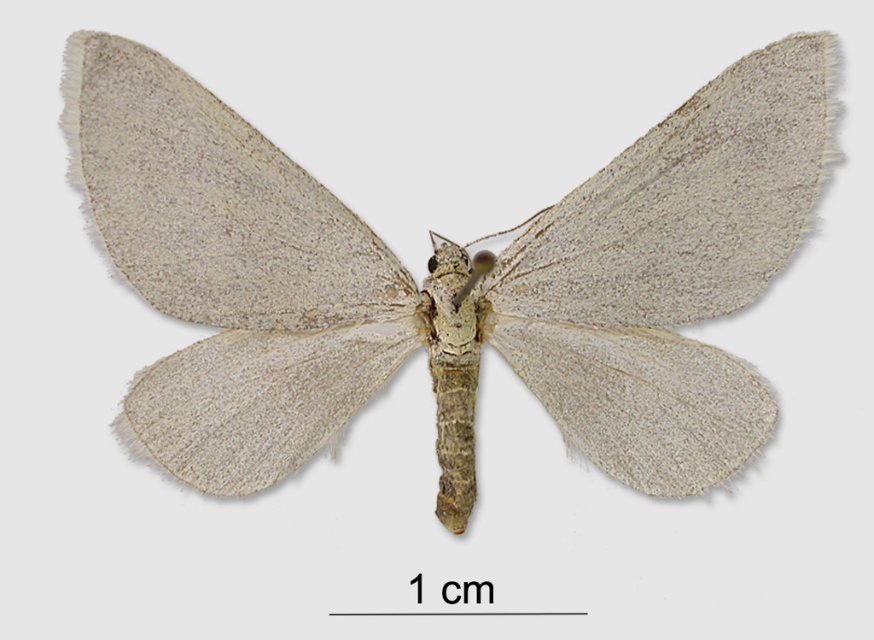
You are an entomologist examining a moth specimen. You notice the fuzzy beige moth at center and the fuzzy gray wing at upper left. Based on their positions, which object is located to the left?

The fuzzy gray wing at upper left is located to the left of the fuzzy beige moth at center.

You are an entomologist examining a moth specimen. You notice the fuzzy gray wing at upper left and the fuzzy white wing at center. Which wing is located below the other?

The fuzzy gray wing at upper left is positioned under the fuzzy white wing at center, meaning the gray wing is below the white one.